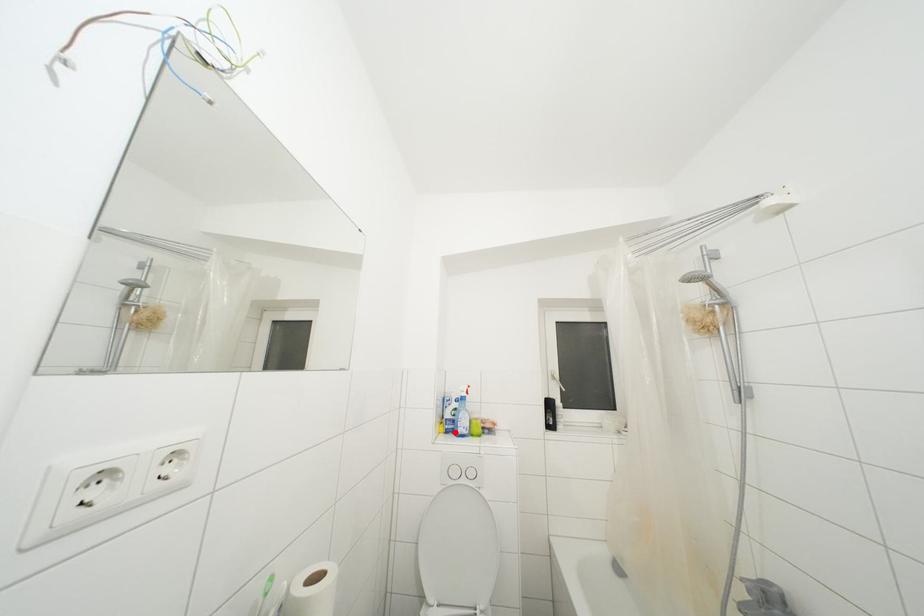
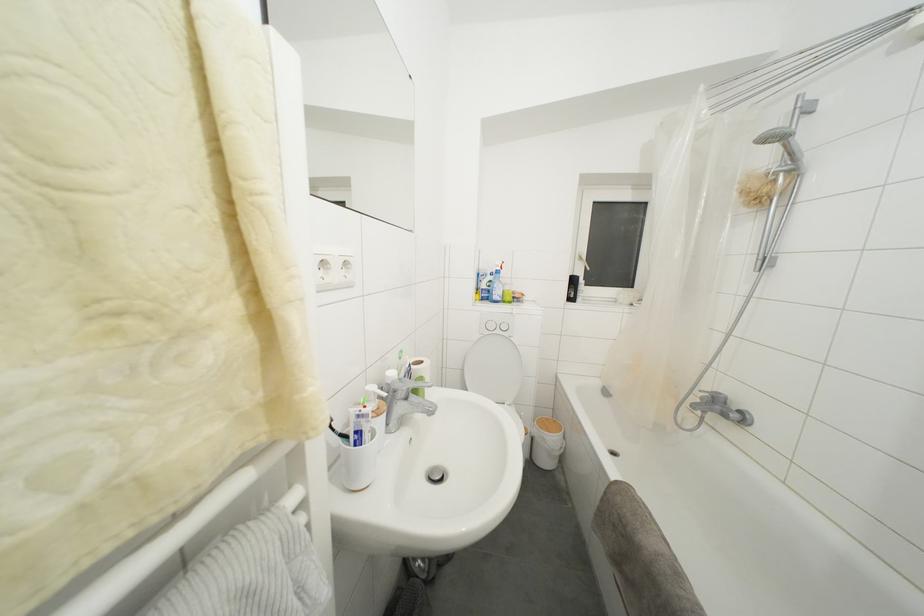
Locate, in the second image, the point that corresponds to the highlighted location in the first image.

(490, 301)